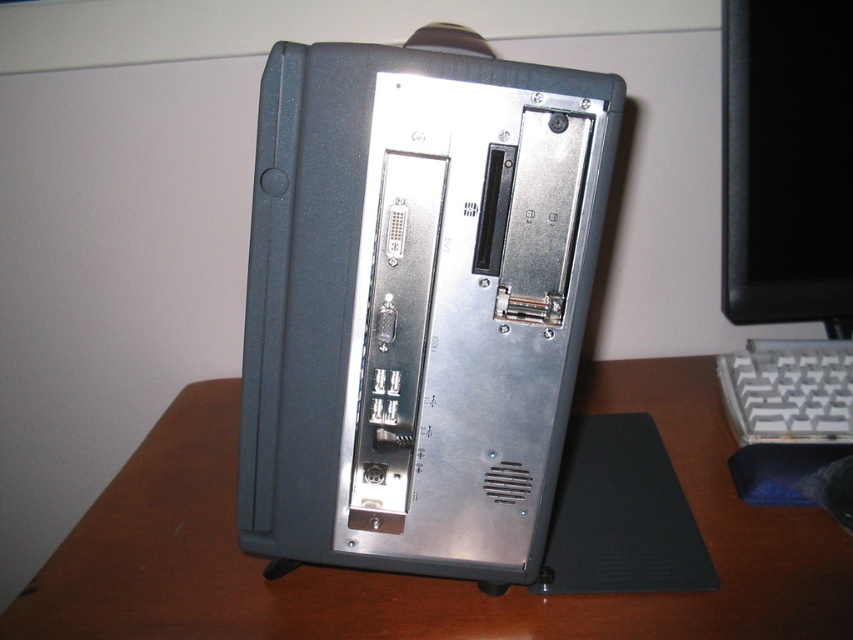
Based on the photo, you are setting up a new computer and need to connect the keyboard to the tower. You see the black glossy monitor at upper right and the white plastic keyboard at lower right. Which object is closer to the tower?

The white plastic keyboard at lower right is closer to the tower than the black glossy monitor at upper right.

You are setting up a new computer and need to place the brown wood computer desk at center and the black glossy monitor at upper right. Based on the scene, which object should be placed lower to ensure proper setup?

The brown wood computer desk at center should be placed lower than the black glossy monitor at upper right because the brown wood computer desk at center is below the black glossy monitor at upper right in the scene.